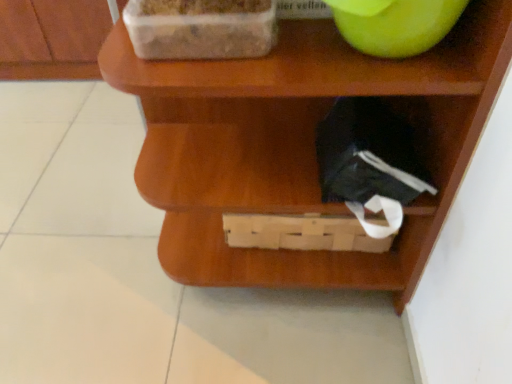
This screenshot has width=512, height=384. Find the location of `free space in front of wooden basket at lower center`. free space in front of wooden basket at lower center is located at coordinates (276, 347).